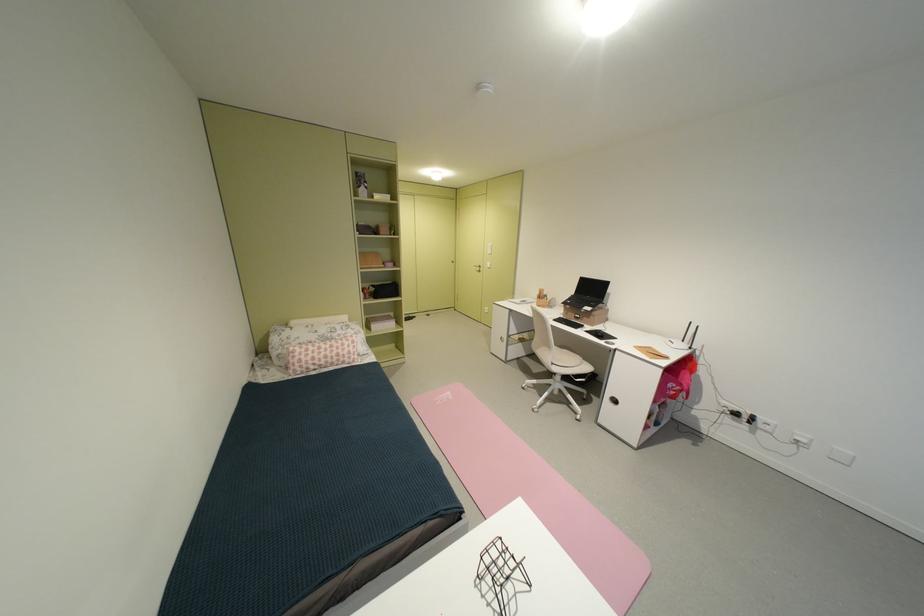
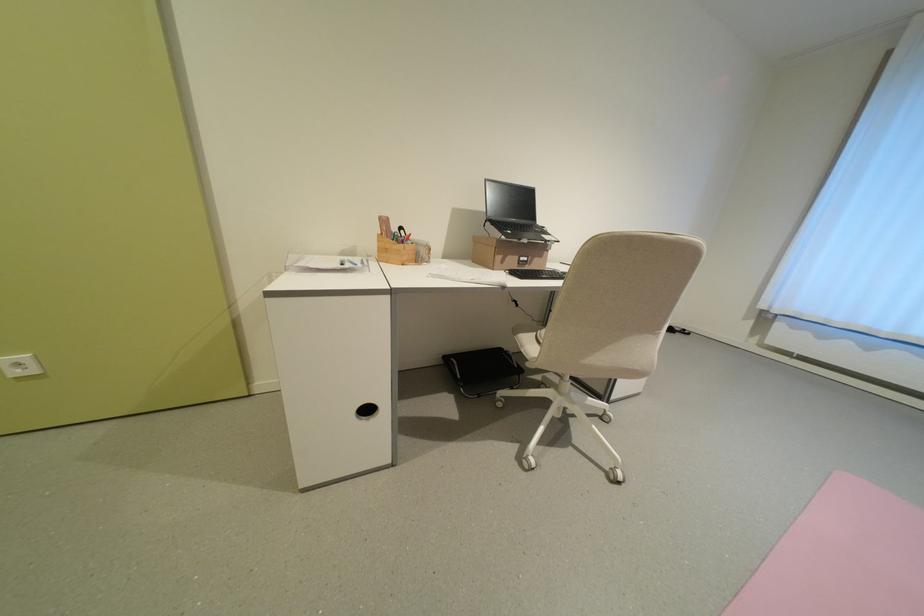
Where in the second image is the point corresponding to (589,317) from the first image?

(536, 261)